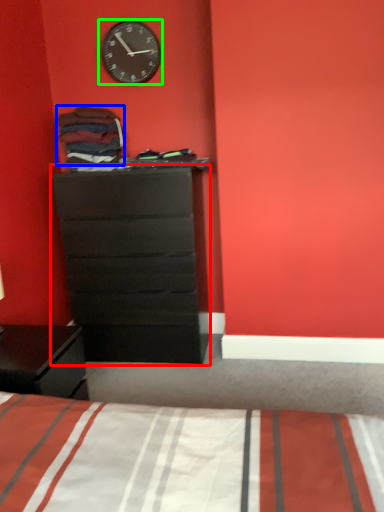
Question: Which object is positioned farthest from chest of drawers (highlighted by a red box)? Select from clothing (highlighted by a blue box) and wall clock (highlighted by a green box).

Choices:
 (A) clothing
 (B) wall clock

Answer: (B)